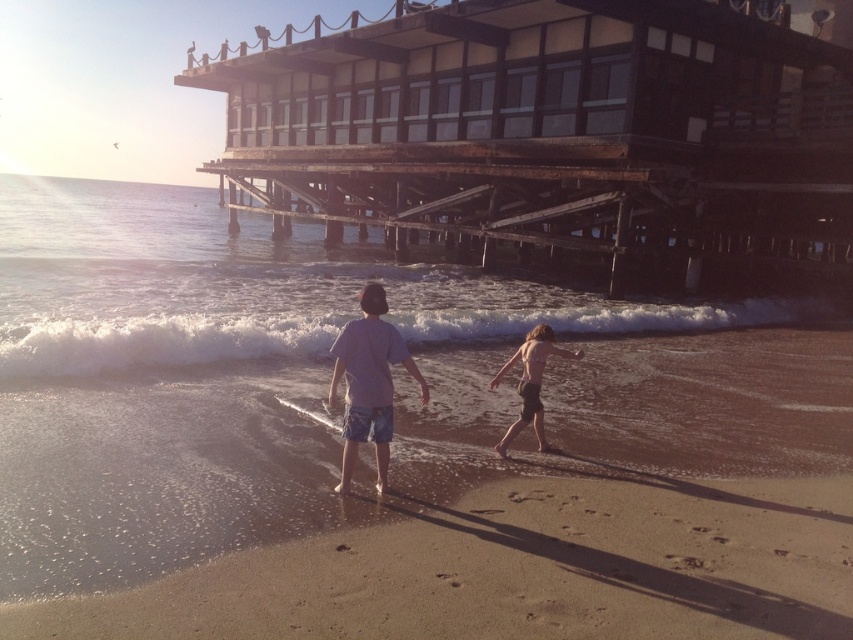
Question: Which point appears closest to the camera in this image?

Choices:
 (A) (279, 588)
 (B) (817, 236)

Answer: (A)

Question: Which point is farther to the camera?

Choices:
 (A) (399, 358)
 (B) (834, 275)

Answer: (B)

Question: Is brown wooden dock at upper center below light blue denim shorts at center?

Choices:
 (A) no
 (B) yes

Answer: (A)

Question: Which of the following is the farthest from the observer?

Choices:
 (A) sandy brown beach at lower center
 (B) light blue denim shorts at center
 (C) brown textured shorts at lower center
 (D) brown wooden dock at upper center

Answer: (D)

Question: Is light blue denim shorts at center wider than brown textured shorts at lower center?

Choices:
 (A) no
 (B) yes

Answer: (A)

Question: From the image, what is the correct spatial relationship of sandy brown beach at lower center in relation to light blue denim shorts at center?

Choices:
 (A) above
 (B) below

Answer: (B)